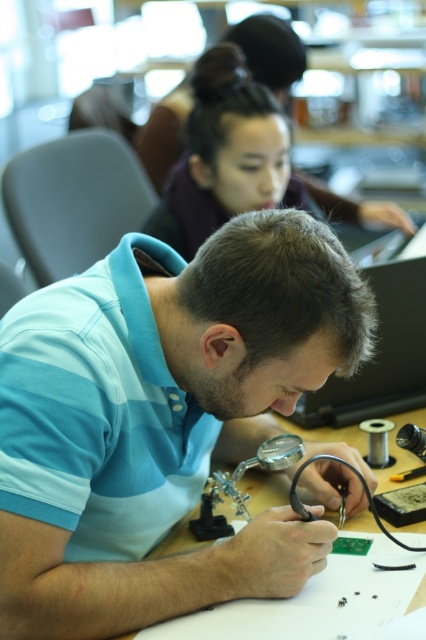
You are standing in front of the table where the man in the light blue and white striped polo shirt is working. There are two points marked on the table surface at coordinates point (267, 186) and point (261, 474). Which point is closer to you?

Point (267, 186) is further to the camera than point (261, 474), so the point closer to you is point (261, 474).

You are a new intern at an electronics workshop and need to move a tool from the blue striped shirt at center to the matte purple shirt at upper center. The tool is 12 inches long. Can you estimate if there is enough space between the two shirts to move the tool without bending it?

The distance between the blue striped shirt at center and the matte purple shirt at upper center is 35.58 inches, which is more than the tool length of 12 inches. Therefore, there is sufficient space to move the tool without bending it.

Based on the coordinates provided, which object is located at point (163, 419) in the image?

The point (163, 419) marks the blue striped shirt at center.